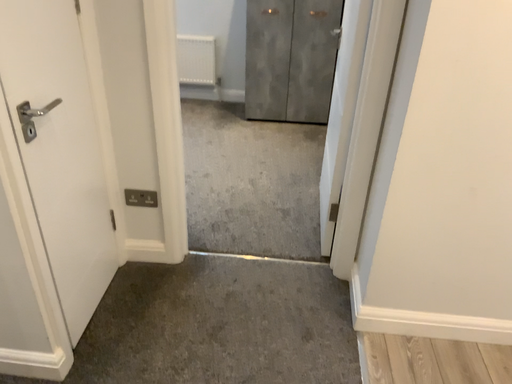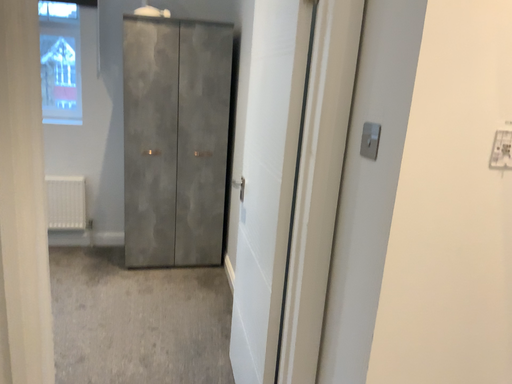
Question: How did the camera likely rotate when shooting the video?

Choices:
 (A) rotated left
 (B) rotated right

Answer: (B)